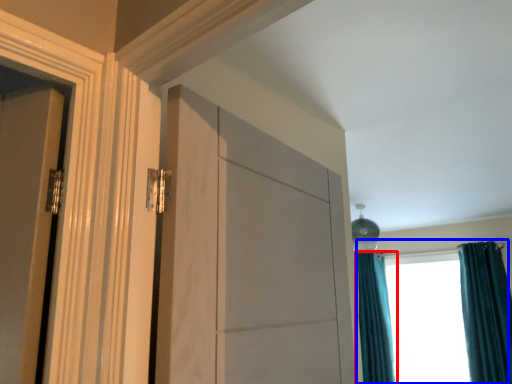
Question: Which point is closer to the camera, curtain (highlighted by a red box) or window (highlighted by a blue box)?

Choices:
 (A) curtain
 (B) window

Answer: (B)